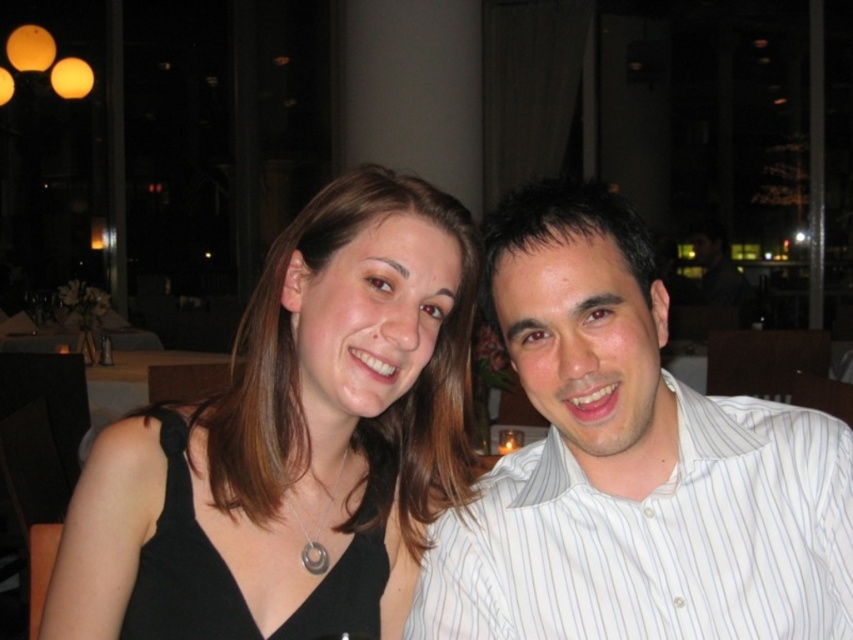
Question: Which object appears farthest from the camera in this image?

Choices:
 (A) black fabric dress at left
 (B) white striped shirt at center

Answer: (A)

Question: Is white striped shirt at center smaller than black fabric dress at left?

Choices:
 (A) no
 (B) yes

Answer: (B)

Question: Is white striped shirt at center below black fabric dress at left?

Choices:
 (A) yes
 (B) no

Answer: (B)

Question: Considering the relative positions of white striped shirt at center and black fabric dress at left in the image provided, where is white striped shirt at center located with respect to black fabric dress at left?

Choices:
 (A) right
 (B) left

Answer: (A)

Question: Which of the following is the closest to the observer?

Choices:
 (A) white striped shirt at center
 (B) black fabric dress at left

Answer: (A)